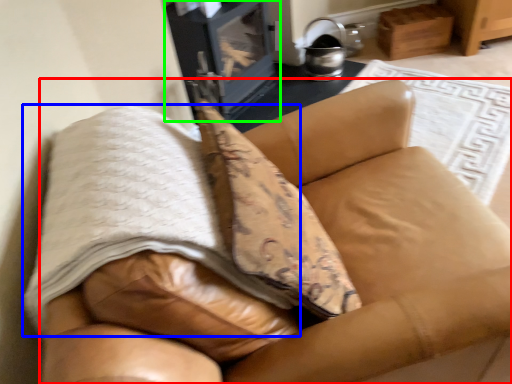
Question: Which is farther away from furniture (highlighted by a red box)? blanket (highlighted by a blue box) or stove (highlighted by a green box)?

Choices:
 (A) blanket
 (B) stove

Answer: (B)